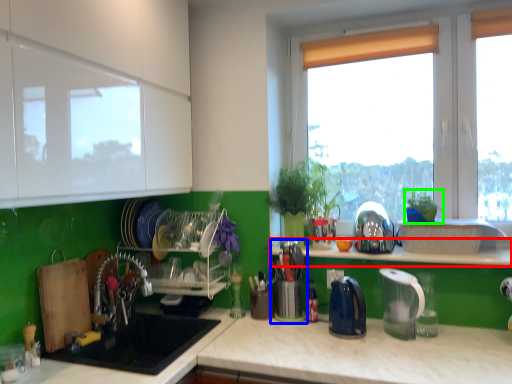
Question: Based on their relative distances, which object is nearer to window sill (highlighted by a red box)? Choose from appliance (highlighted by a blue box) and plant (highlighted by a green box).

Choices:
 (A) appliance
 (B) plant

Answer: (B)